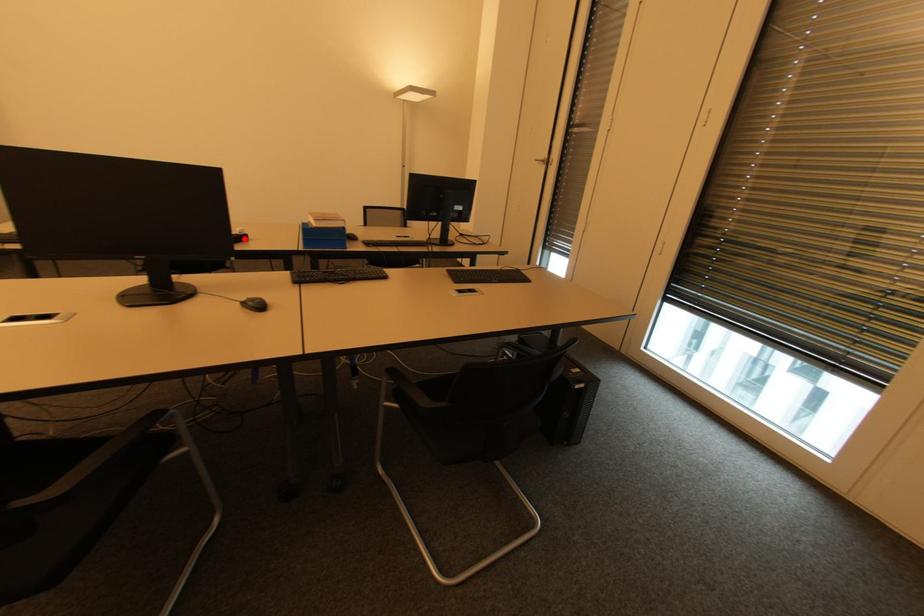
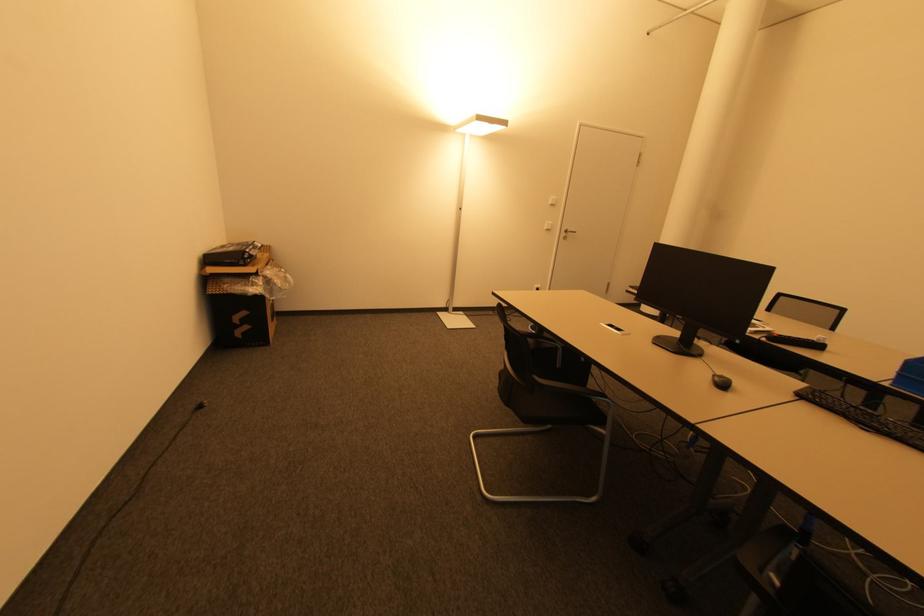
Question: A red point is marked in image1. In image2, is the corresponding 3D point closer to the camera or farther? Reply with the corresponding letter.

Choices:
 (A) The corresponding 3D point is closer.
 (B) The corresponding 3D point is farther.

Answer: (B)